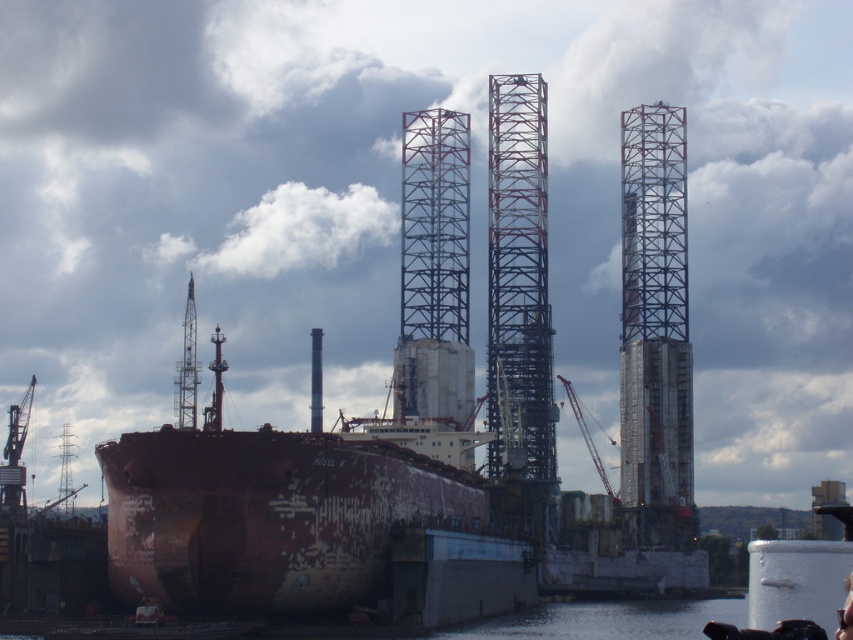
You are a maintenance worker on the ship and need to assess the height of the clear water at lower center and the metallic gray crane at center. Which object is shorter?

The clear water at lower center is shorter than the metallic gray crane at center according to the description.

You are standing at the point marked as point [605,620] in the shipyard scene. What is the immediate surface you are standing on?

The point [605,620] is on clear water at lower center, so you are standing on clear water.

Based on the photo, you are an engineer inspecting the shipyard. You see the rusty metal crane at center and the metallic gray crane at center. Which one has a greater height?

The rusty metal crane at center is much taller than the metallic gray crane at center.